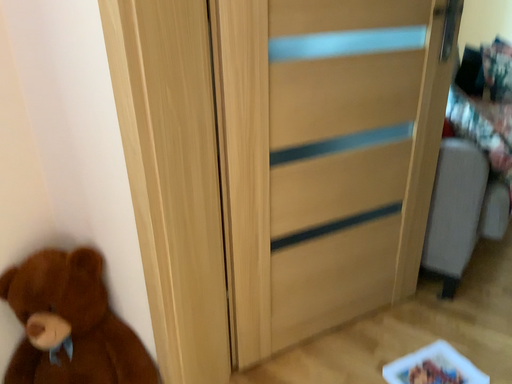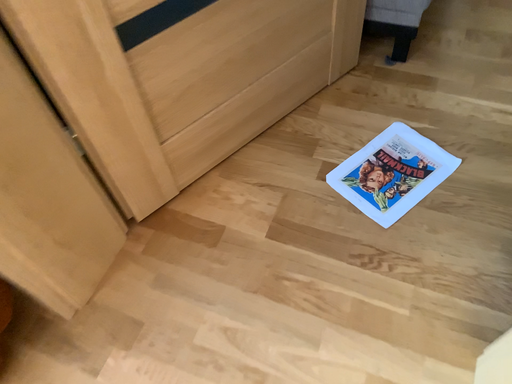
Question: Which way did the camera rotate in the video?

Choices:
 (A) rotated right
 (B) rotated left

Answer: (A)